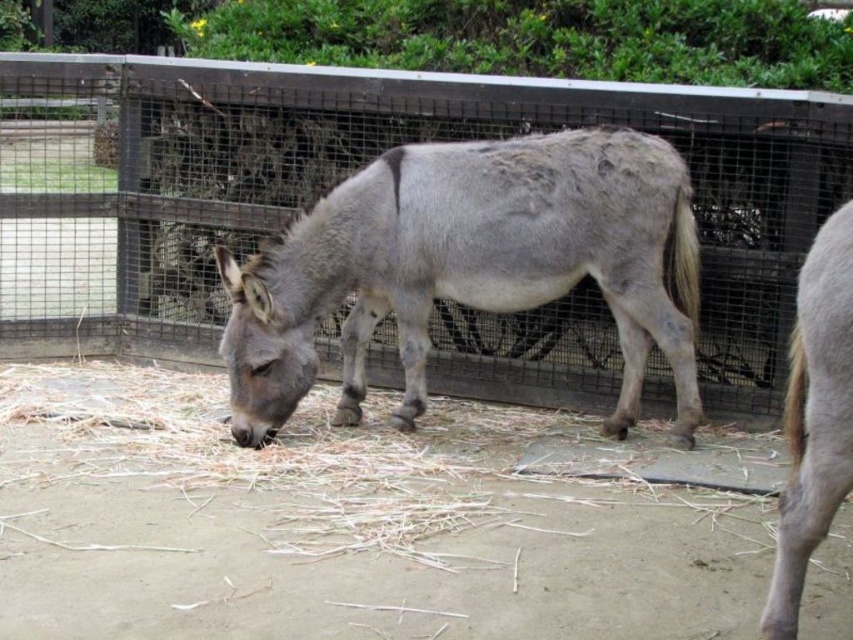
You are standing in the garden outside the enclosure and want to approach the gray matte donkey at center. Which direction should you move relative to the wooden fence at center to get closer to the donkey?

You should move to the right of the wooden fence at center to approach the gray matte donkey at center, as the wooden fence at center is to the left of the gray matte donkey at center.

You are standing in the enclosure with the gray matte donkey at center and the gray matte horse at right. If you want to see the garden beyond the fence, which animal should you move past to get a better view?

You should move past the gray matte donkey at center because the gray matte horse at right is behind it, so moving around the donkey would allow you to see the garden beyond the fence.

You are a farmer checking the enclosure for safety. The wooden fence at center must be at least as tall as the gray matte horse at right to prevent escape. Is the current fence height sufficient?

The wooden fence at center has a lesser height compared to the gray matte horse at right, so the fence is not tall enough to prevent the horse from escaping.